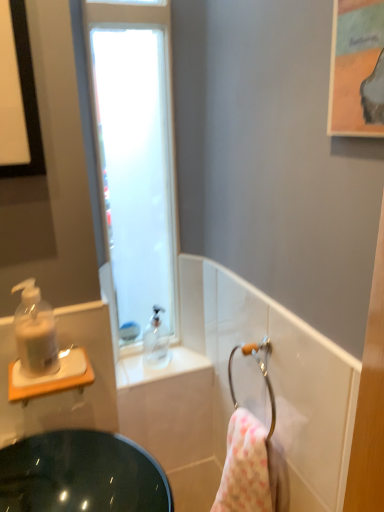
At what (x,y) coordinates should I click in order to perform the action: click on white textured towel at lower right. Please return your answer as a coordinate pair (x, y). The height and width of the screenshot is (512, 384). Looking at the image, I should click on (244, 467).

What do you see at coordinates (73, 433) in the screenshot? I see `translucent plastic sink at left` at bounding box center [73, 433].

How much space does transparent plastic soap dispenser at upper center, the 1th soap dispenser in the right-to-left sequence, occupy horizontally?

transparent plastic soap dispenser at upper center, the 1th soap dispenser in the right-to-left sequence, is 2.71 inches in width.

The height and width of the screenshot is (512, 384). What are the coordinates of `white textured towel at lower right` in the screenshot? It's located at (244, 467).

Looking at this image, considering the relative sizes of translucent plastic soap dispenser at left, which is the 2th soap dispenser in back-to-front order, and white textured towel at lower right in the image provided, is translucent plastic soap dispenser at left, which is the 2th soap dispenser in back-to-front order, thinner than white textured towel at lower right?

Yes.

Who is smaller, translucent plastic soap dispenser at left, positioned as the 2th soap dispenser in right-to-left order, or white textured towel at lower right?

With smaller size is translucent plastic soap dispenser at left, positioned as the 2th soap dispenser in right-to-left order.

From the image's perspective, is translucent plastic soap dispenser at left, the 1th soap dispenser positioned from the left, located beneath white textured towel at lower right?

No, from the image's perspective, translucent plastic soap dispenser at left, the 1th soap dispenser positioned from the left, is not beneath white textured towel at lower right.

Is white textured towel at lower right inside translucent plastic soap dispenser at left, which is the 2th soap dispenser in back-to-front order?

No, white textured towel at lower right is not a part of translucent plastic soap dispenser at left, which is the 2th soap dispenser in back-to-front order.

Can you confirm if translucent plastic soap dispenser at left, the 1th soap dispenser positioned from the left, is wider than transparent plastic soap dispenser at upper center, which ranks as the first soap dispenser in back-to-front order?

Yes.

Is translucent plastic soap dispenser at left, the 1th soap dispenser positioned from the left, not inside transparent plastic soap dispenser at upper center, which appears as the second soap dispenser when viewed from the front?

That's correct, translucent plastic soap dispenser at left, the 1th soap dispenser positioned from the left, is outside of transparent plastic soap dispenser at upper center, which appears as the second soap dispenser when viewed from the front.

Is translucent plastic soap dispenser at left, which is the 2th soap dispenser in back-to-front order, facing towards transparent plastic soap dispenser at upper center, the 1th soap dispenser in the right-to-left sequence?

No, translucent plastic soap dispenser at left, which is the 2th soap dispenser in back-to-front order, is not oriented towards transparent plastic soap dispenser at upper center, the 1th soap dispenser in the right-to-left sequence.

From a real-world perspective, which object rests below the other?

transparent plastic soap dispenser at upper center, the 2th soap dispenser viewed from the left, is physically lower.

Locate an element on the screen. sink on the left of white textured towel at lower right is located at coordinates (73, 433).

Is translucent plastic sink at left positioned behind white textured towel at lower right?

No, it is not.

Which is more to the left, translucent plastic sink at left or white textured towel at lower right?

translucent plastic sink at left is more to the left.

From a real-world perspective, relative to frosted glass window at upper left, is translucent plastic sink at left vertically above or below?

In terms of real-world spatial position, translucent plastic sink at left is below frosted glass window at upper left.

Is translucent plastic sink at left thinner than frosted glass window at upper left?

Correct, the width of translucent plastic sink at left is less than that of frosted glass window at upper left.

Between translucent plastic sink at left and frosted glass window at upper left, which one has smaller size?

With smaller size is translucent plastic sink at left.

Looking at this image, is translucent plastic sink at left not close to frosted glass window at upper left?

translucent plastic sink at left is actually quite close to frosted glass window at upper left.

What's the angular difference between frosted glass window at upper left and transparent plastic soap dispenser at upper center, which ranks as the first soap dispenser in back-to-front order,'s facing directions?

The angular difference between frosted glass window at upper left and transparent plastic soap dispenser at upper center, which ranks as the first soap dispenser in back-to-front order, is 2.24 degrees.

Where is `soap dispenser behind the frosted glass window at upper left`? soap dispenser behind the frosted glass window at upper left is located at coordinates (156, 342).

How distant is frosted glass window at upper left from transparent plastic soap dispenser at upper center, the 1th soap dispenser in the right-to-left sequence?

frosted glass window at upper left is 37.06 centimeters away from transparent plastic soap dispenser at upper center, the 1th soap dispenser in the right-to-left sequence.

Can you confirm if frosted glass window at upper left is positioned to the left of transparent plastic soap dispenser at upper center, the 2th soap dispenser viewed from the left?

Yes, frosted glass window at upper left is to the left of transparent plastic soap dispenser at upper center, the 2th soap dispenser viewed from the left.

Would you say transparent plastic soap dispenser at upper center, which ranks as the first soap dispenser in back-to-front order, is outside white textured towel at lower right?

Indeed, transparent plastic soap dispenser at upper center, which ranks as the first soap dispenser in back-to-front order, is completely outside white textured towel at lower right.

Considering the positions of objects transparent plastic soap dispenser at upper center, which ranks as the first soap dispenser in back-to-front order, and white textured towel at lower right in the image provided, who is behind, transparent plastic soap dispenser at upper center, which ranks as the first soap dispenser in back-to-front order, or white textured towel at lower right?

transparent plastic soap dispenser at upper center, which ranks as the first soap dispenser in back-to-front order, is more distant.

Does transparent plastic soap dispenser at upper center, the 1th soap dispenser in the right-to-left sequence, have a lesser height compared to white textured towel at lower right?

Indeed, transparent plastic soap dispenser at upper center, the 1th soap dispenser in the right-to-left sequence, has a lesser height compared to white textured towel at lower right.

Measure the distance between translucent plastic soap dispenser at left, which is the first soap dispenser in front-to-back order, and frosted glass window at upper left.

A distance of 17.98 inches exists between translucent plastic soap dispenser at left, which is the first soap dispenser in front-to-back order, and frosted glass window at upper left.

Is translucent plastic soap dispenser at left, positioned as the 2th soap dispenser in right-to-left order, completely or partially outside of frosted glass window at upper left?

Yes.

The width and height of the screenshot is (384, 512). Find the location of `window located behind the translucent plastic soap dispenser at left, which is the first soap dispenser in front-to-back order`. window located behind the translucent plastic soap dispenser at left, which is the first soap dispenser in front-to-back order is located at coordinates (134, 159).

From a real-world perspective, is translucent plastic soap dispenser at left, which is the first soap dispenser in front-to-back order, on frosted glass window at upper left?

No, from a real-world perspective, translucent plastic soap dispenser at left, which is the first soap dispenser in front-to-back order, is not above frosted glass window at upper left.

You are a GUI agent. You are given a task and a screenshot of the screen. Output one action in this format:
    pyautogui.click(x=<x>, y=<y>)
    Task: Click on the bath towel on the right of the translucent plastic soap dispenser at left, which is the 2th soap dispenser in back-to-front order
    
    Given the screenshot: What is the action you would take?
    [244, 467]

Where is `soap dispenser that is below the translucent plastic soap dispenser at left, positioned as the 2th soap dispenser in right-to-left order (from the image's perspective)`? The height and width of the screenshot is (512, 384). soap dispenser that is below the translucent plastic soap dispenser at left, positioned as the 2th soap dispenser in right-to-left order (from the image's perspective) is located at coordinates (156, 342).

Based on their spatial positions, is frosted glass window at upper left or white textured towel at lower right closer to transparent plastic soap dispenser at upper center, the 2th soap dispenser viewed from the left?

The object closer to transparent plastic soap dispenser at upper center, the 2th soap dispenser viewed from the left, is frosted glass window at upper left.

Considering their positions, is translucent plastic sink at left positioned closer to white textured towel at lower right than translucent plastic soap dispenser at left, which is the first soap dispenser in front-to-back order?

Among the two, translucent plastic sink at left is located nearer to white textured towel at lower right.

In the scene shown: Looking at the image, which one is located further to white textured towel at lower right, frosted glass window at upper left or transparent plastic soap dispenser at upper center, the 1th soap dispenser in the right-to-left sequence?

frosted glass window at upper left is further to white textured towel at lower right.

From the picture: From the image, which object appears to be nearer to transparent plastic soap dispenser at upper center, the 1th soap dispenser in the right-to-left sequence, translucent plastic soap dispenser at left, which is the first soap dispenser in front-to-back order, or frosted glass window at upper left?

frosted glass window at upper left.

When comparing their distances from translucent plastic soap dispenser at left, which is the 2th soap dispenser in back-to-front order, does white textured towel at lower right or translucent plastic sink at left seem further?

white textured towel at lower right lies further to translucent plastic soap dispenser at left, which is the 2th soap dispenser in back-to-front order, than the other object.

From the image, which object appears to be nearer to translucent plastic soap dispenser at left, the 1th soap dispenser positioned from the left, transparent plastic soap dispenser at upper center, the 1th soap dispenser in the right-to-left sequence, or translucent plastic sink at left?

Among the two, translucent plastic sink at left is located nearer to translucent plastic soap dispenser at left, the 1th soap dispenser positioned from the left.

From the picture: Looking at the image, which one is located closer to white textured towel at lower right, translucent plastic sink at left or transparent plastic soap dispenser at upper center, the 1th soap dispenser in the right-to-left sequence?

Based on the image, translucent plastic sink at left appears to be nearer to white textured towel at lower right.

Considering their positions, is frosted glass window at upper left positioned closer to translucent plastic sink at left than translucent plastic soap dispenser at left, positioned as the 2th soap dispenser in right-to-left order?

The object closer to translucent plastic sink at left is translucent plastic soap dispenser at left, positioned as the 2th soap dispenser in right-to-left order.

Identify the location of window between translucent plastic soap dispenser at left, the 1th soap dispenser positioned from the left, and transparent plastic soap dispenser at upper center, which appears as the second soap dispenser when viewed from the front, along the z-axis. This screenshot has width=384, height=512. (134, 159).

I want to click on sink positioned between translucent plastic soap dispenser at left, positioned as the 2th soap dispenser in right-to-left order, and transparent plastic soap dispenser at upper center, the 1th soap dispenser in the right-to-left sequence, from near to far, so pos(73,433).

This screenshot has width=384, height=512. Identify the location of sink between frosted glass window at upper left and white textured towel at lower right in the vertical direction. (73, 433).

Image resolution: width=384 pixels, height=512 pixels. What are the coordinates of `bath towel between translucent plastic soap dispenser at left, positioned as the 2th soap dispenser in right-to-left order, and transparent plastic soap dispenser at upper center, the 2th soap dispenser viewed from the left, along the z-axis` in the screenshot? It's located at (244, 467).